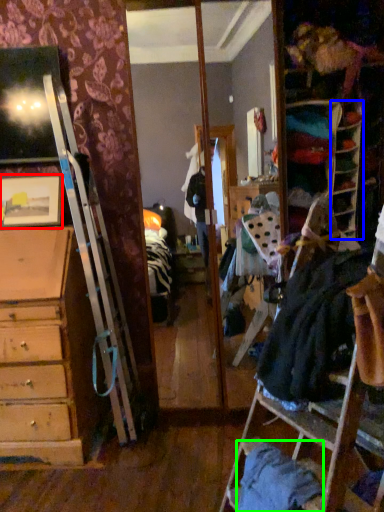
Question: Estimate the real-world distances between objects in this image. Which object is closer to picture frame (highlighted by a red box), shelf (highlighted by a blue box) or clothing (highlighted by a green box)?

Choices:
 (A) shelf
 (B) clothing

Answer: (A)